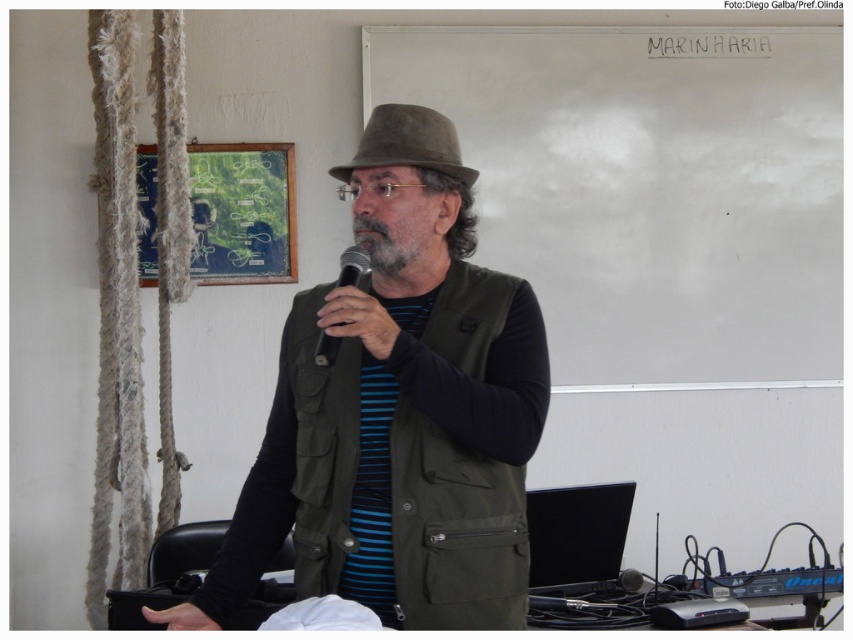
Can you confirm if matte olive green vest at center is taller than brown felt fedora at upper center?

Yes, matte olive green vest at center is taller than brown felt fedora at upper center.

Is matte olive green vest at center positioned at the back of brown felt fedora at upper center?

No, matte olive green vest at center is in front of brown felt fedora at upper center.

Identify the location of matte olive green vest at center. The width and height of the screenshot is (853, 640). (398, 419).

Which is more to the right, brown felt fedora at upper center or black matte microphone at center?

From the viewer's perspective, brown felt fedora at upper center appears more on the right side.

Between brown felt fedora at upper center and black matte microphone at center, which one appears on the left side from the viewer's perspective?

black matte microphone at center is more to the left.

Locate an element on the screen. The image size is (853, 640). brown felt fedora at upper center is located at coordinates (408, 144).

Does point (460, 163) come closer to viewer compared to point (424, 280)?

Yes, point (460, 163) is closer to viewer.

Locate an element on the screen. This screenshot has width=853, height=640. brown felt fedora at upper center is located at coordinates (408, 144).